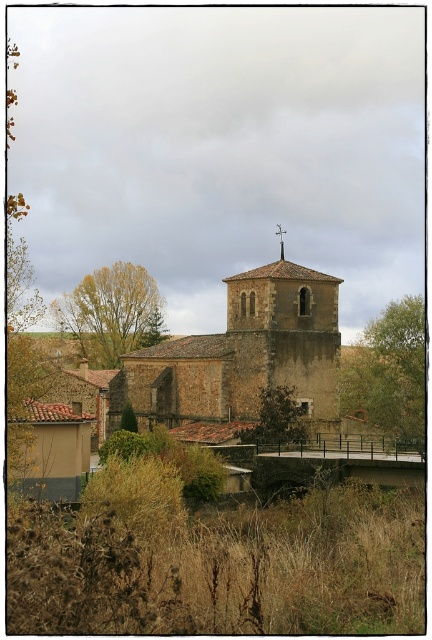
Between green leafy tree at upper center and brown textured tree at center, which one has less height?

Standing shorter between the two is brown textured tree at center.

Based on the photo, is green leafy tree at upper center shorter than brown textured tree at center?

No.

Find the location of a particular element. green leafy tree at upper center is located at coordinates pos(387,371).

Who is positioned more to the right, yellow-green leaves at left or brown textured tree at center?

brown textured tree at center

Who is more forward, (69, 305) or (273, 422)?

Positioned in front is point (273, 422).

Is point (153, 301) more distant than point (269, 435)?

Yes.

Identify the location of yellow-green leaves at left. This screenshot has height=640, width=432. (111, 312).

Who is higher up, brown stone church tower at center or brown textured tree at center?

Positioned higher is brown stone church tower at center.

Is point (285, 275) more distant than point (288, 387)?

Yes.

The height and width of the screenshot is (640, 432). Find the location of `brown stone church tower at center`. brown stone church tower at center is located at coordinates (283, 337).